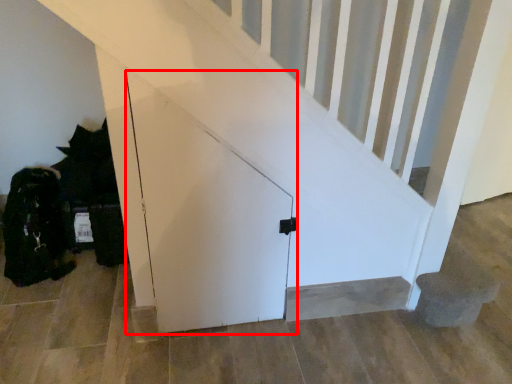
Question: From the image's perspective, where is door (annotated by the red box) located in relation to stairwell in the image?

Choices:
 (A) below
 (B) above

Answer: (B)